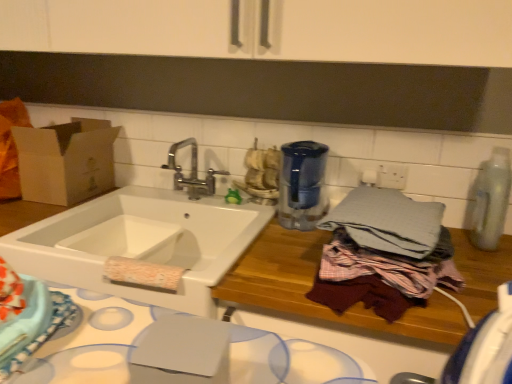
Identify the location of free space to the left of blue glass water filter at center, the 1th appliance when ordered from left to right. This screenshot has width=512, height=384. (251, 215).